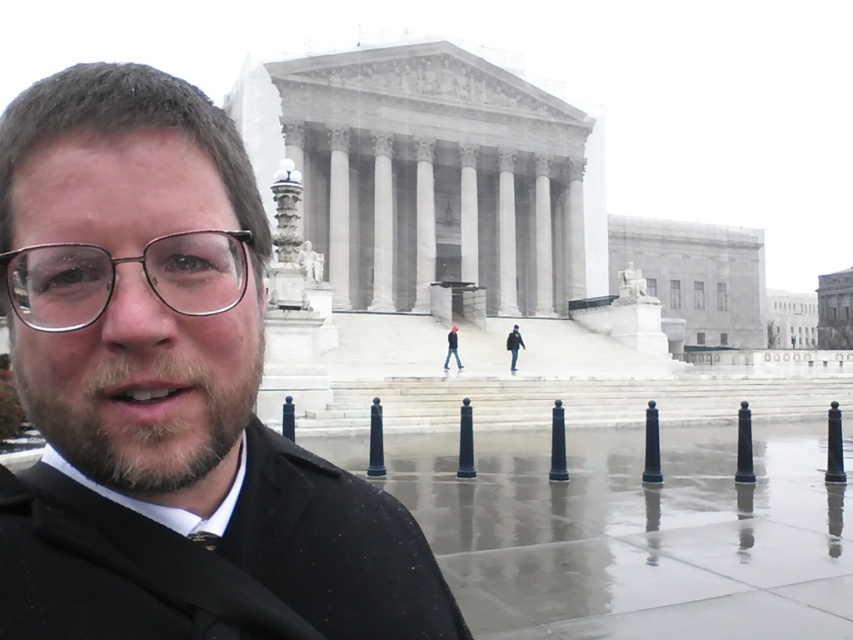
In the scene shown: Does black matte coat at center appear under dark gray jacket at center?

Actually, black matte coat at center is above dark gray jacket at center.

Between point (73, 515) and point (514, 346), which one is positioned behind?

The point (514, 346) is more distant.

Identify the location of black matte coat at center. (167, 394).

Is point (251, 401) behind point (448, 348)?

No, it is not.

Does brown fuzzy beard at center come behind light brown leather jacket at center?

No, brown fuzzy beard at center is closer to the viewer.

Which is behind, point (126, 376) or point (456, 324)?

Point (456, 324)

Where is `brown fuzzy beard at center`? brown fuzzy beard at center is located at coordinates (146, 416).

At what (x,y) coordinates should I click in order to perform the action: click on black matte coat at center. Please return your answer as a coordinate pair (x, y). Looking at the image, I should click on (167, 394).

Who is lower down, black matte coat at center or light brown leather jacket at center?

light brown leather jacket at center is lower down.

Does point (231, 612) come in front of point (453, 333)?

Yes, point (231, 612) is closer to viewer.

Where is `black matte coat at center`? This screenshot has width=853, height=640. black matte coat at center is located at coordinates (167, 394).